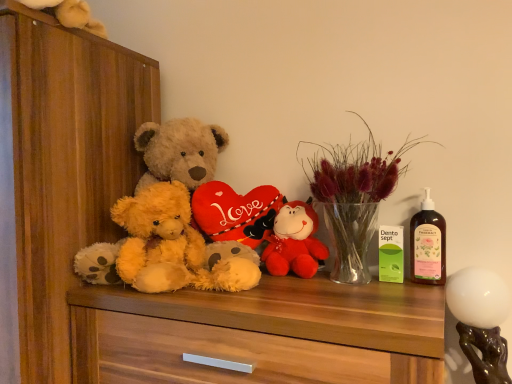
Question: From a real-world perspective, is fluffy yellow teddy bear at center above or below velvet plush bear at center, the 1th toy viewed from the left?

Choices:
 (A) below
 (B) above

Answer: (B)

Question: From the image's perspective, is fluffy yellow teddy bear at center positioned above or below velvet plush bear at center, which is the 1th toy from back to front?

Choices:
 (A) below
 (B) above

Answer: (B)

Question: Which object is the closest to the velvet plush bear at center, which is the 1th toy from back to front?

Choices:
 (A) wooden dresser at left
 (B) translucent plastic bottle at right
 (C) white glossy lampshade at right, positioned as the 2th toy in left-to-right order
 (D) translucent glass vase at center
 (E) soft brown plush at center

Answer: (D)

Question: Considering the real-world distances, which object is farthest from the fluffy yellow teddy bear at center?

Choices:
 (A) velvet plush bear at center, which is the 1th toy from back to front
 (B) white glossy lampshade at right, positioned as the 2th toy in left-to-right order
 (C) wooden dresser at left
 (D) translucent glass vase at center
 (E) translucent plastic bottle at right

Answer: (B)